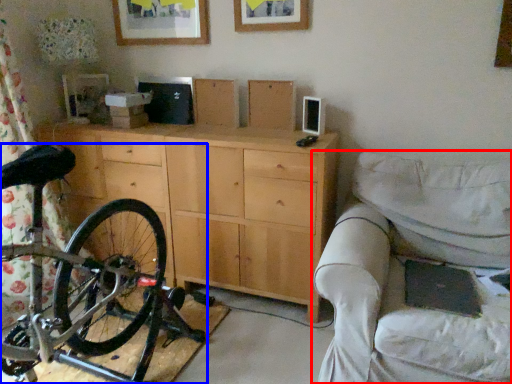
Question: Which object appears closest to the camera in this image, studio couch (highlighted by a red box) or bicycle (highlighted by a blue box)?

Choices:
 (A) studio couch
 (B) bicycle

Answer: (B)